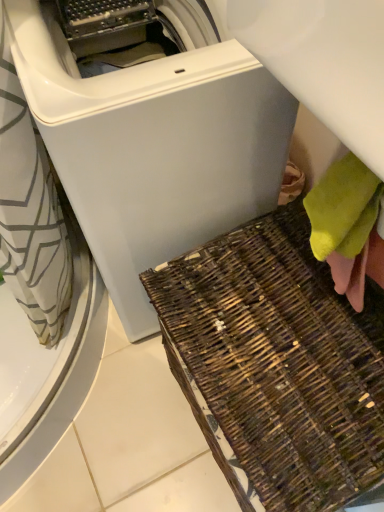
Locate an element on the screen. This screenshot has width=384, height=512. vacant area in front of soft yellow towel at lower right is located at coordinates tap(332, 381).